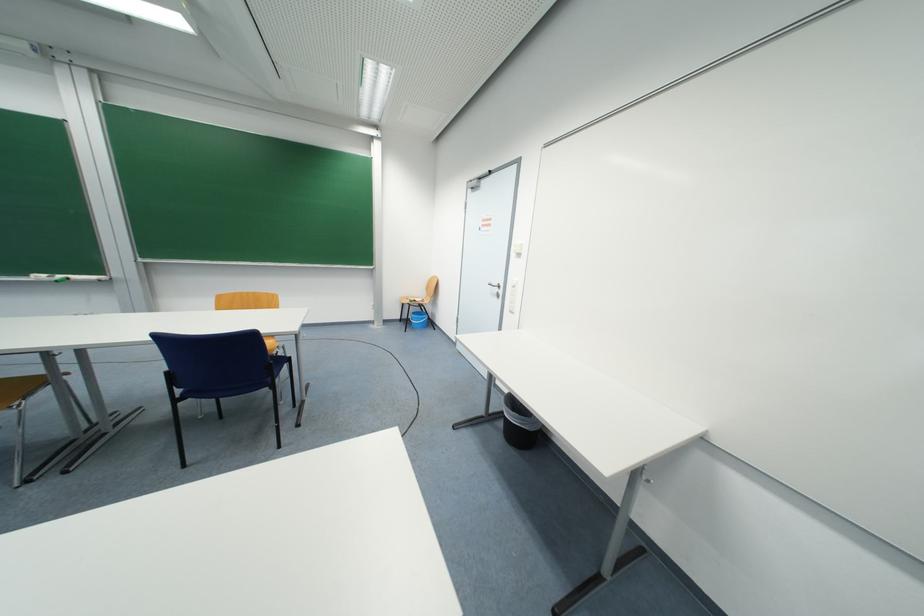
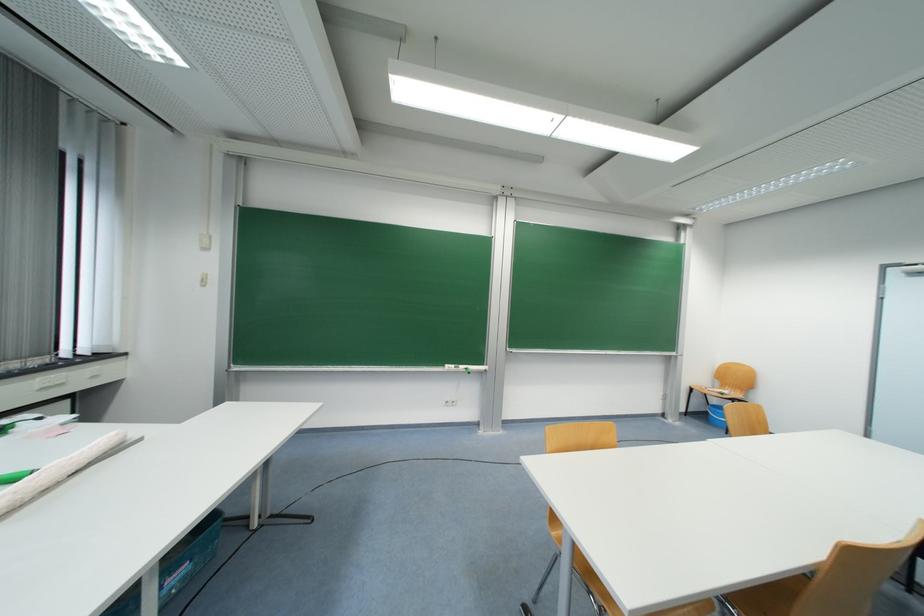
Locate, in the second image, the point that corresponds to point 66,278 in the first image.

(467, 369)